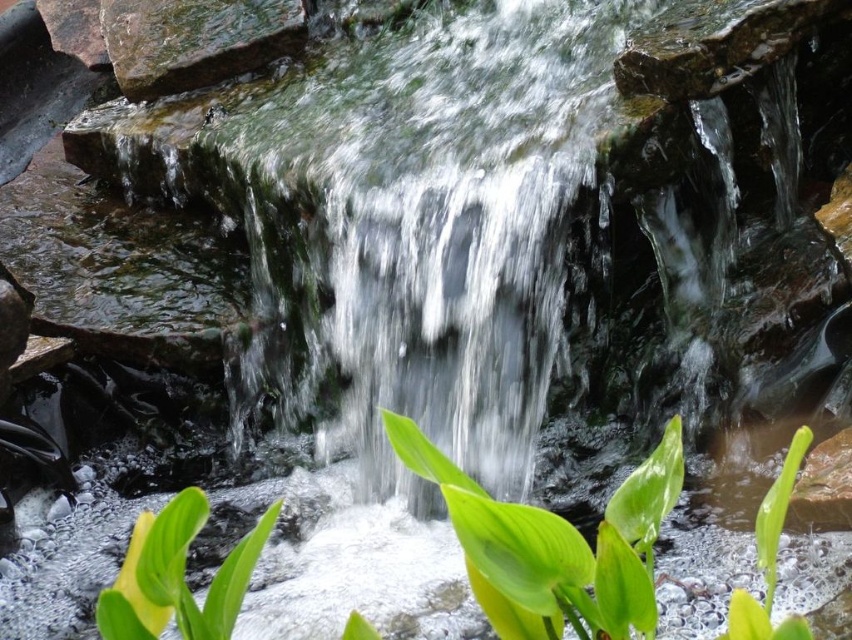
You are a botanist examining the waterfall area. You notice the green glossy leaf at center and the green leafy plant at lower right. Which of these two has a larger size?

The green leafy plant at lower right is larger in size compared to the green glossy leaf at center.